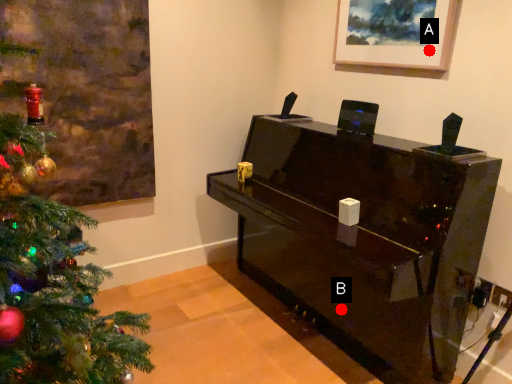
Question: Two points are circled on the image, labeled by A and B beside each circle. Which point appears farthest from the camera in this image?

Choices:
 (A) A is further
 (B) B is further

Answer: (B)